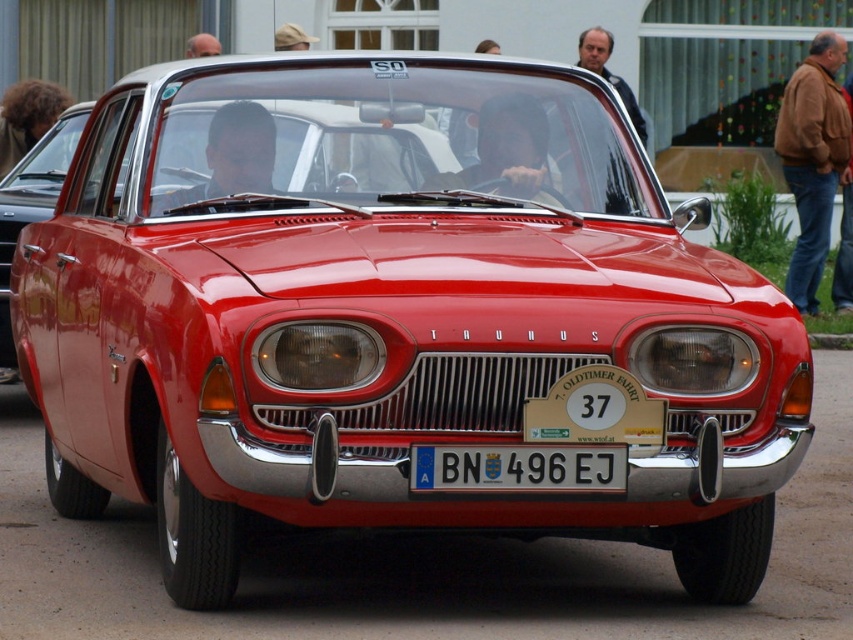
Question: Which point appears farthest from the camera in this image?

Choices:
 (A) (532, 477)
 (B) (3, 244)

Answer: (B)

Question: Does black plastic license plate at center have a lesser width compared to shiny red car at center?

Choices:
 (A) no
 (B) yes

Answer: (A)

Question: Is black plastic license plate at center smaller than shiny red car at center?

Choices:
 (A) no
 (B) yes

Answer: (B)

Question: Which point is farther to the camera?

Choices:
 (A) shiny red car at center
 (B) black plastic license plate at center

Answer: (A)

Question: Does black plastic license plate at center appear over shiny red car at center?

Choices:
 (A) yes
 (B) no

Answer: (B)